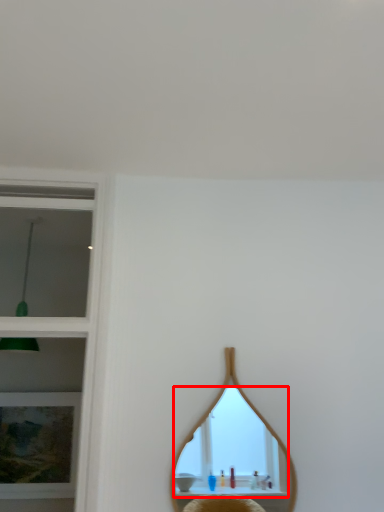
Question: Observing the image, what is the correct spatial positioning of mirror (annotated by the red box) in reference to picture frame?

Choices:
 (A) right
 (B) left

Answer: (A)